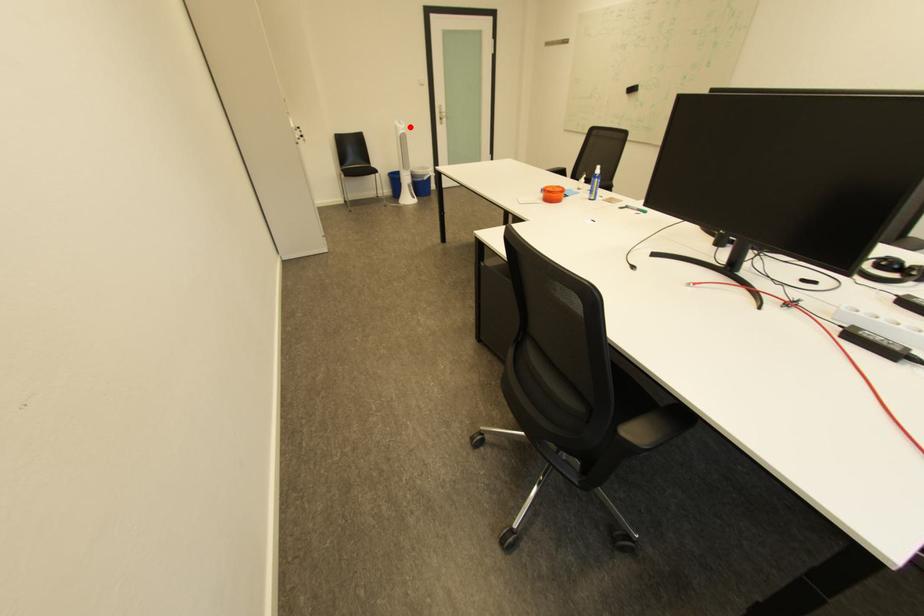
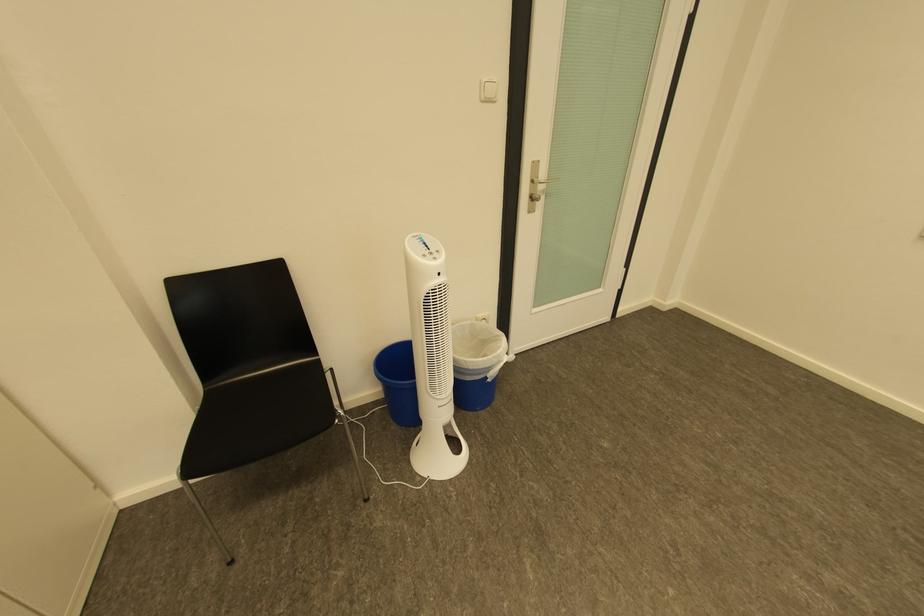
Question: I am providing you with two images of the same scene from different viewpoints. Image1 has a red point marked. In image2, the corresponding 3D location appears at what relative position? Reply with the corresponding letter.

Choices:
 (A) Closer
 (B) Farther

Answer: (B)